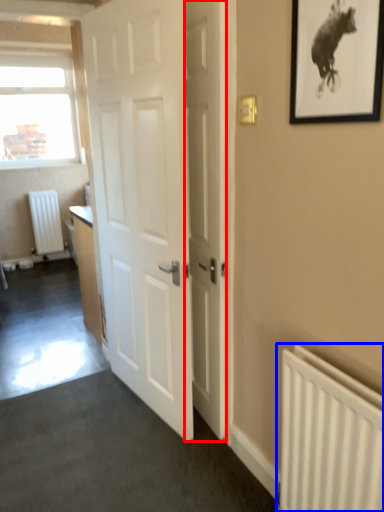
Question: Among these objects, which one is farthest to the camera, door (highlighted by a red box) or radiator (highlighted by a blue box)?

Choices:
 (A) door
 (B) radiator

Answer: (A)